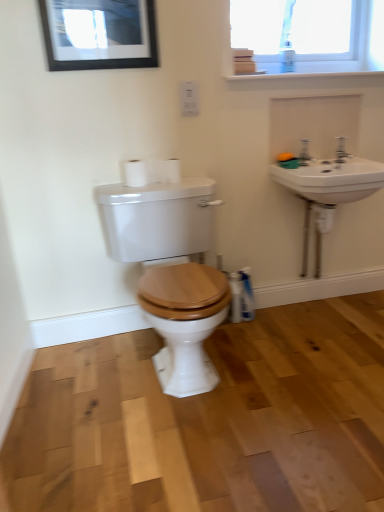
Question: From a real-world perspective, is silver metallic faucet at upper right positioned over wooden toilet seat at center based on gravity?

Choices:
 (A) no
 (B) yes

Answer: (B)

Question: Is silver metallic faucet at upper right bigger than wooden toilet seat at center?

Choices:
 (A) no
 (B) yes

Answer: (A)

Question: Does silver metallic faucet at upper right lie in front of wooden toilet seat at center?

Choices:
 (A) yes
 (B) no

Answer: (B)

Question: Is silver metallic faucet at upper right wider than wooden toilet seat at center?

Choices:
 (A) no
 (B) yes

Answer: (A)

Question: Does silver metallic faucet at upper right contain wooden toilet seat at center?

Choices:
 (A) no
 (B) yes

Answer: (A)

Question: Considering the positions of orange matte soap at upper right and matte black picture frame at upper left in the image, is orange matte soap at upper right taller or shorter than matte black picture frame at upper left?

Choices:
 (A) tall
 (B) short

Answer: (B)

Question: Considering the positions of orange matte soap at upper right and matte black picture frame at upper left in the image, is orange matte soap at upper right wider or thinner than matte black picture frame at upper left?

Choices:
 (A) wide
 (B) thin

Answer: (A)

Question: Considering their positions, is orange matte soap at upper right located in front of or behind matte black picture frame at upper left?

Choices:
 (A) front
 (B) behind

Answer: (B)

Question: Is orange matte soap at upper right to the left or to the right of matte black picture frame at upper left in the image?

Choices:
 (A) left
 (B) right

Answer: (B)

Question: From the image's perspective, is silver metallic faucet at upper right positioned above or below white plastic bottle at lower right?

Choices:
 (A) below
 (B) above

Answer: (B)

Question: Is silver metallic faucet at upper right inside the boundaries of white plastic bottle at lower right, or outside?

Choices:
 (A) outside
 (B) inside

Answer: (A)

Question: In the image, is silver metallic faucet at upper right on the left side or the right side of white plastic bottle at lower right?

Choices:
 (A) right
 (B) left

Answer: (A)

Question: From a real-world perspective, is silver metallic faucet at upper right positioned above or below white plastic bottle at lower right?

Choices:
 (A) above
 (B) below

Answer: (A)

Question: In terms of height, does white matte toilet paper at upper center, the second toilet paper from the left, look taller or shorter compared to white plastic bottle at lower right?

Choices:
 (A) tall
 (B) short

Answer: (B)

Question: Based on their positions, is white matte toilet paper at upper center, the second toilet paper from the left, located to the left or right of white plastic bottle at lower right?

Choices:
 (A) right
 (B) left

Answer: (B)